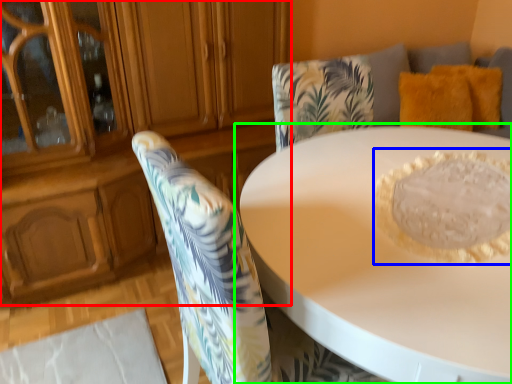
Question: Which object is the closest to the dresser (highlighted by a red box)? Choose among these: food (highlighted by a blue box) or table (highlighted by a green box).

Choices:
 (A) food
 (B) table

Answer: (B)